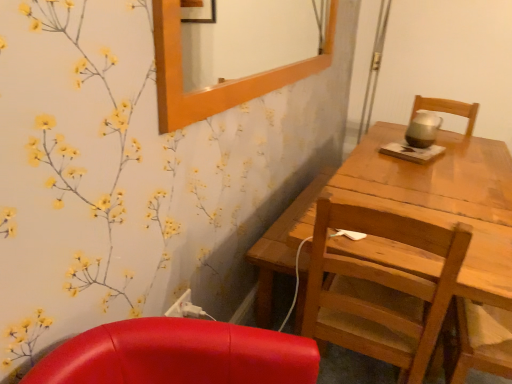
Question: Visually, is gold metallic teapot at upper right positioned to the left or to the right of wooden frame at upper center?

Choices:
 (A) right
 (B) left

Answer: (A)

Question: Looking at the image, does gold metallic teapot at upper right seem bigger or smaller compared to wooden frame at upper center?

Choices:
 (A) small
 (B) big

Answer: (A)

Question: Estimate the real-world distances between objects in this image. Which object is farther from the gold metallic teapot at upper right?

Choices:
 (A) wooden frame at upper center
 (B) white plastic power outlet at lower center
 (C) wooden chair at right

Answer: (A)

Question: Estimate the real-world distances between objects in this image. Which object is closer to the wooden chair at right?

Choices:
 (A) wooden frame at upper center
 (B) gold metallic teapot at upper right
 (C) white plastic power outlet at lower center

Answer: (C)